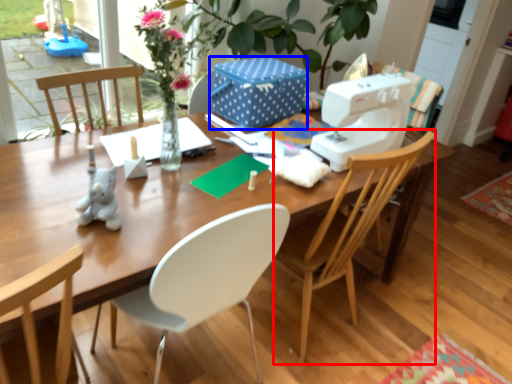
Question: Which object is closer to the camera taking this photo, chair (highlighted by a red box) or box (highlighted by a blue box)?

Choices:
 (A) chair
 (B) box

Answer: (A)